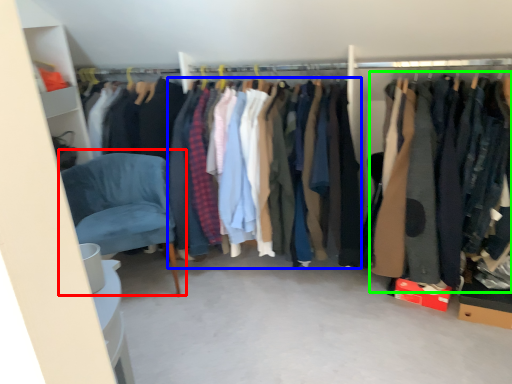
Question: Based on their relative distances, which object is nearer to chair (highlighted by a red box)? Choose from clothing (highlighted by a blue box) and clothing (highlighted by a green box).

Choices:
 (A) clothing
 (B) clothing

Answer: (A)